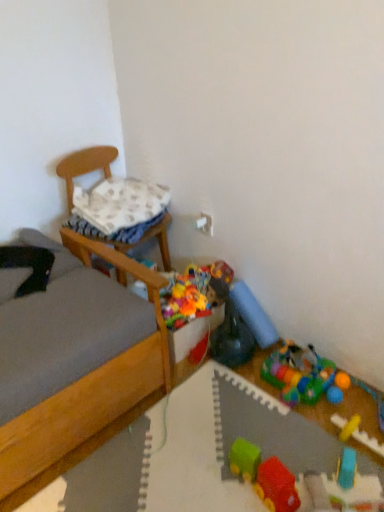
What is the approximate width of white textured pillow at upper left?

white textured pillow at upper left is 13.63 inches in width.

Where is `wooden bed at left`? The width and height of the screenshot is (384, 512). wooden bed at left is located at coordinates (73, 362).

What are the coordinates of `yellow rubber train at lower right, placed as the fifth toy when sorted from back to front` in the screenshot? It's located at (369, 442).

The height and width of the screenshot is (512, 384). Find the location of `rubberized plastic train at center, the 1th toy in the front-to-back sequence`. rubberized plastic train at center, the 1th toy in the front-to-back sequence is located at coordinates (265, 476).

Describe the element at coordinates (265, 476) in the screenshot. This screenshot has height=512, width=384. I see `rubberized plastic train at center, the 1th toy in the front-to-back sequence` at that location.

What is the approximate width of rubberized plastic toy at lower right, the 6th toy when ordered from front to back?

It is 4.90 inches.

This screenshot has width=384, height=512. What do you see at coordinates (302, 375) in the screenshot?
I see `rubberized plastic play mat at lower right, the third toy viewed from the back` at bounding box center [302, 375].

Identify the location of blue rubber toy at lower right, which is the 3th toy from front to back. (346, 468).

From the image's perspective, is rubberized plastic toy at lower right, the 6th toy when ordered from front to back, over white textured pillow at upper left?

No, from the image's perspective, rubberized plastic toy at lower right, the 6th toy when ordered from front to back, is not over white textured pillow at upper left.

Consider the image. Which object is positioned more to the right, rubberized plastic toy at lower right, the 6th toy when ordered from front to back, or white textured pillow at upper left?

Positioned to the right is rubberized plastic toy at lower right, the 6th toy when ordered from front to back.

Is rubberized plastic toy at lower right, placed as the first toy when sorted from back to front, aimed at white textured pillow at upper left?

No, rubberized plastic toy at lower right, placed as the first toy when sorted from back to front, is not oriented towards white textured pillow at upper left.

Considering their positions, is white textured pillow at upper left located in front of or behind wooden chair at left?

Clearly, white textured pillow at upper left is behind wooden chair at left.

Looking at their sizes, would you say white textured pillow at upper left is wider or thinner than wooden chair at left?

Considering their sizes, white textured pillow at upper left looks slimmer than wooden chair at left.

How many degrees apart are the facing directions of white textured pillow at upper left and wooden chair at left?

They differ by 5.86 degrees in their facing directions.

Which object is positioned more to the right, white textured pillow at upper left or wooden chair at left?

wooden chair at left is more to the right.

Which is behind, wooden bed at left or rubberized plastic play mat at lower right, the third toy viewed from the back?

rubberized plastic play mat at lower right, the third toy viewed from the back, is more distant.

Is rubberized plastic play mat at lower right, placed as the 4th toy when sorted from front to back, a part of wooden bed at left?

Definitely not — rubberized plastic play mat at lower right, placed as the 4th toy when sorted from front to back, is not inside wooden bed at left.

Is wooden bed at left to the left of rubberized plastic play mat at lower right, placed as the 4th toy when sorted from front to back, from the viewer's perspective?

Yes, wooden bed at left is to the left of rubberized plastic play mat at lower right, placed as the 4th toy when sorted from front to back.

Can you confirm if wooden bed at left is taller than rubberized plastic play mat at lower right, placed as the 4th toy when sorted from front to back?

Yes, wooden bed at left is taller than rubberized plastic play mat at lower right, placed as the 4th toy when sorted from front to back.

From a real-world perspective, is wooden chair at left physically above rubberized plastic toy at lower right, the 6th toy when ordered from front to back?

Indeed, from a real-world perspective, wooden chair at left stands above rubberized plastic toy at lower right, the 6th toy when ordered from front to back.

Consider the image. Can you tell me how much wooden chair at left and rubberized plastic toy at lower right, placed as the first toy when sorted from back to front, differ in facing direction?

The angular difference between wooden chair at left and rubberized plastic toy at lower right, placed as the first toy when sorted from back to front, is 101 degrees.

Considering the sizes of objects wooden chair at left and rubberized plastic toy at lower right, placed as the first toy when sorted from back to front, in the image provided, who is wider, wooden chair at left or rubberized plastic toy at lower right, placed as the first toy when sorted from back to front,?

wooden chair at left.

Is rubberized plastic toy at lower right, placed as the first toy when sorted from back to front, a part of wooden chair at left?

Actually, rubberized plastic toy at lower right, placed as the first toy when sorted from back to front, is outside wooden chair at left.

From the image's perspective, is rubberized plastic train at center, positioned as the 6th toy in back-to-front order, above blue rubber toy at lower right, which is the 3th toy from front to back?

Indeed, from the image's perspective, rubberized plastic train at center, positioned as the 6th toy in back-to-front order, is shown above blue rubber toy at lower right, which is the 3th toy from front to back.

From a real-world perspective, is rubberized plastic train at center, positioned as the 6th toy in back-to-front order, on top of blue rubber toy at lower right, which is the 3th toy from front to back?

Yes, from a real-world perspective, rubberized plastic train at center, positioned as the 6th toy in back-to-front order, is on top of blue rubber toy at lower right, which is the 3th toy from front to back.

The image size is (384, 512). Find the location of `the 3rd toy counting from the right of the rubberized plastic train at center, the 1th toy in the front-to-back sequence`. the 3rd toy counting from the right of the rubberized plastic train at center, the 1th toy in the front-to-back sequence is located at coordinates click(346, 468).

Would you consider rubberized plastic toy at lower right, the 6th toy when ordered from front to back, to be distant from rubberized plastic play mat at lower right, placed as the 4th toy when sorted from front to back?

No, there isn't a large distance between rubberized plastic toy at lower right, the 6th toy when ordered from front to back, and rubberized plastic play mat at lower right, placed as the 4th toy when sorted from front to back.

Is rubberized plastic toy at lower right, the 6th toy when ordered from front to back, to the left or to the right of rubberized plastic play mat at lower right, the third toy viewed from the back, in the image?

In the image, rubberized plastic toy at lower right, the 6th toy when ordered from front to back, appears on the left side of rubberized plastic play mat at lower right, the third toy viewed from the back.

Considering the relative sizes of rubberized plastic toy at lower right, the 6th toy when ordered from front to back, and rubberized plastic play mat at lower right, placed as the 4th toy when sorted from front to back, in the image provided, is rubberized plastic toy at lower right, the 6th toy when ordered from front to back, shorter than rubberized plastic play mat at lower right, placed as the 4th toy when sorted from front to back,?

No, rubberized plastic toy at lower right, the 6th toy when ordered from front to back, is not shorter than rubberized plastic play mat at lower right, placed as the 4th toy when sorted from front to back.

From the image's perspective, is rubberized plastic toy at lower right, placed as the first toy when sorted from back to front, above rubberized plastic play mat at lower right, the third toy viewed from the back?

Yes, from the image's perspective, rubberized plastic toy at lower right, placed as the first toy when sorted from back to front, is above rubberized plastic play mat at lower right, the third toy viewed from the back.

Which of these two, wooden chair at left or blue rubber toy at lower right, which is the fourth toy in back-to-front order, stands taller?

wooden chair at left is taller.

Who is smaller, wooden chair at left or blue rubber toy at lower right, which is the 3th toy from front to back?

blue rubber toy at lower right, which is the 3th toy from front to back.

How much distance is there between wooden chair at left and blue rubber toy at lower right, which is the 3th toy from front to back?

The distance of wooden chair at left from blue rubber toy at lower right, which is the 3th toy from front to back, is 1.57 meters.

Considering the relative sizes of wooden chair at left and blue rubber toy at lower right, which is the 3th toy from front to back, in the image provided, is wooden chair at left wider than blue rubber toy at lower right, which is the 3th toy from front to back,?

Yes, wooden chair at left is wider than blue rubber toy at lower right, which is the 3th toy from front to back.

Identify the location of pillow behind the rubberized plastic toy at lower right, the 6th toy when ordered from front to back. This screenshot has height=512, width=384. (118, 209).

At what (x,y) coordinates should I click in order to perform the action: click on pillow located above the wooden chair at left (from a real-world perspective). Please return your answer as a coordinate pair (x, y). Looking at the image, I should click on (118, 209).

Looking at the image, which one is located closer to rubberized plastic train at center, positioned as the 6th toy in back-to-front order, wooden chair at left or yellow rubber train at lower right, which is the 2th toy from front to back?

The object closer to rubberized plastic train at center, positioned as the 6th toy in back-to-front order, is yellow rubber train at lower right, which is the 2th toy from front to back.

From the image, which object appears to be nearer to white textured pillow at upper left, wooden chair at left or rubberized plastic toy at lower right, placed as the first toy when sorted from back to front?

wooden chair at left is positioned closer to the anchor white textured pillow at upper left.

Estimate the real-world distances between objects in this image. Which object is closer to yellow rubber train at lower right, placed as the fifth toy when sorted from back to front, rubberized plastic play mat at lower right, placed as the 4th toy when sorted from front to back, or wooden bed at left?

rubberized plastic play mat at lower right, placed as the 4th toy when sorted from front to back, is positioned closer to the anchor yellow rubber train at lower right, placed as the fifth toy when sorted from back to front.

Looking at this image, considering their positions, is white textured pillow at upper left positioned further to wooden chair at left than yellow rubber train at lower right, which is the 2th toy from front to back?

The object further to wooden chair at left is yellow rubber train at lower right, which is the 2th toy from front to back.

When comparing their distances from rubberized plastic train at center, positioned as the 6th toy in back-to-front order, does blue rubber toy at lower right, which is the 3th toy from front to back, or rubber duck at center, which is counted as the fifth toy, starting from the front, seem closer?

Among the two, blue rubber toy at lower right, which is the 3th toy from front to back, is located nearer to rubberized plastic train at center, positioned as the 6th toy in back-to-front order.

Consider the image. From the image, which object appears to be nearer to rubberized plastic toy at lower right, the 6th toy when ordered from front to back, yellow rubber train at lower right, placed as the fifth toy when sorted from back to front, or wooden bed at left?

A: yellow rubber train at lower right, placed as the fifth toy when sorted from back to front, is positioned closer to the anchor rubberized plastic toy at lower right, the 6th toy when ordered from front to back.

Based on their spatial positions, is wooden bed at left or rubberized plastic play mat at lower right, placed as the 4th toy when sorted from front to back, further from yellow rubber train at lower right, placed as the fifth toy when sorted from back to front?

wooden bed at left is further to yellow rubber train at lower right, placed as the fifth toy when sorted from back to front.

Looking at the image, which one is located further to white textured pillow at upper left, yellow rubber train at lower right, which is the 2th toy from front to back, or rubberized plastic train at center, the 1th toy in the front-to-back sequence?

Based on the image, yellow rubber train at lower right, which is the 2th toy from front to back, appears to be further to white textured pillow at upper left.

The image size is (384, 512). Identify the location of toy positioned between blue rubber toy at lower right, which is the 3th toy from front to back, and rubber duck at center, which is counted as the fifth toy, starting from the front, from near to far. (302, 375).

This screenshot has width=384, height=512. What are the coordinates of `chair between wooden bed at left and blue rubber toy at lower right, which is the 3th toy from front to back` in the screenshot? It's located at (85, 166).

Identify the location of bed between white textured pillow at upper left and rubberized plastic train at center, the 1th toy in the front-to-back sequence, in the vertical direction. (73, 362).

The width and height of the screenshot is (384, 512). What are the coordinates of `chair between wooden bed at left and rubberized plastic play mat at lower right, placed as the 4th toy when sorted from front to back` in the screenshot? It's located at (85, 166).